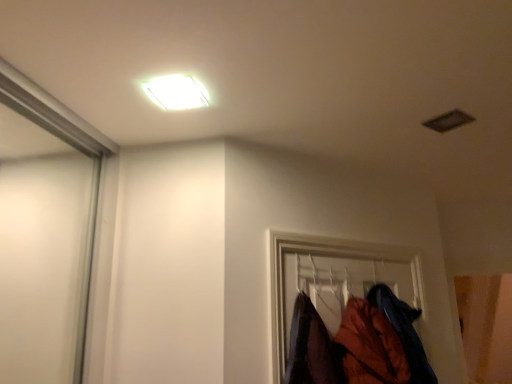
Question: Should I look upward or downward to see orange fabric coat at lower right, which is counted as the 2th clothing, starting from the left?

Choices:
 (A) up
 (B) down

Answer: (B)

Question: From the image's perspective, would you say white glossy light fixture at upper center is positioned over velvet-like orange coat at lower right, which is the second clothing in right-to-left order?

Choices:
 (A) yes
 (B) no

Answer: (A)

Question: Is white glossy light fixture at upper center positioned with its back to velvet-like orange coat at lower right, which is the first clothing from left to right?

Choices:
 (A) yes
 (B) no

Answer: (B)

Question: From a real-world perspective, does white glossy light fixture at upper center sit lower than velvet-like orange coat at lower right, which is the first clothing from left to right?

Choices:
 (A) no
 (B) yes

Answer: (A)

Question: Could you tell me if white glossy light fixture at upper center is turned towards velvet-like orange coat at lower right, which is the second clothing in right-to-left order?

Choices:
 (A) no
 (B) yes

Answer: (A)

Question: Considering the relative sizes of white glossy light fixture at upper center and velvet-like orange coat at lower right, which is the first clothing from left to right, in the image provided, is white glossy light fixture at upper center taller than velvet-like orange coat at lower right, which is the first clothing from left to right,?

Choices:
 (A) yes
 (B) no

Answer: (B)

Question: Does white glossy light fixture at upper center have a smaller size compared to velvet-like orange coat at lower right, which is the second clothing in right-to-left order?

Choices:
 (A) no
 (B) yes

Answer: (B)

Question: Considering the relative positions of orange fabric coat at lower right, which is counted as the 2th clothing, starting from the left, and white glossy light fixture at upper center in the image provided, is orange fabric coat at lower right, which is counted as the 2th clothing, starting from the left, to the left of white glossy light fixture at upper center from the viewer's perspective?

Choices:
 (A) no
 (B) yes

Answer: (A)

Question: Is orange fabric coat at lower right, placed as the 1th clothing when sorted from right to left, outside white glossy light fixture at upper center?

Choices:
 (A) yes
 (B) no

Answer: (A)

Question: Is orange fabric coat at lower right, placed as the 1th clothing when sorted from right to left, further to the viewer compared to white glossy light fixture at upper center?

Choices:
 (A) yes
 (B) no

Answer: (A)

Question: Can you confirm if orange fabric coat at lower right, which is counted as the 2th clothing, starting from the left, is taller than white glossy light fixture at upper center?

Choices:
 (A) no
 (B) yes

Answer: (B)

Question: Is orange fabric coat at lower right, which is counted as the 2th clothing, starting from the left, shorter than white glossy light fixture at upper center?

Choices:
 (A) yes
 (B) no

Answer: (B)

Question: Could you tell me if orange fabric coat at lower right, placed as the 1th clothing when sorted from right to left, is facing white glossy light fixture at upper center?

Choices:
 (A) yes
 (B) no

Answer: (B)

Question: From a real-world perspective, is velvet-like orange coat at lower right, which is the first clothing from left to right, beneath white glossy light fixture at upper center?

Choices:
 (A) no
 (B) yes

Answer: (B)